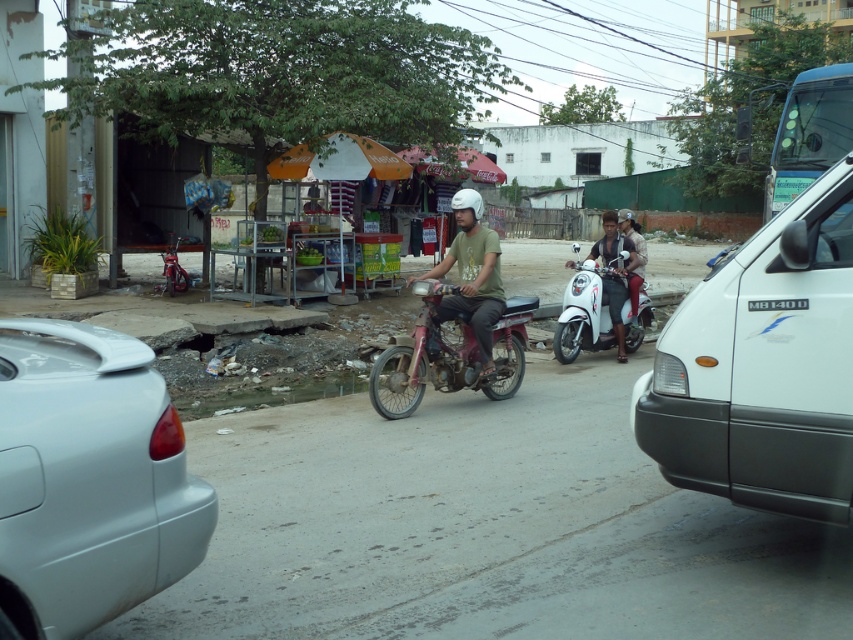
Which of these two, rusty metal motorcycle at center or matte green t-shirt at center, stands shorter?

rusty metal motorcycle at center

Does rusty metal motorcycle at center appear on the right side of matte green t-shirt at center?

In fact, rusty metal motorcycle at center is to the left of matte green t-shirt at center.

Who is more forward, (503, 369) or (473, 284)?

Point (473, 284) is more forward.

What are the coordinates of `rusty metal motorcycle at center` in the screenshot? It's located at (448, 355).

Does point (811, 490) come behind point (637, 259)?

No.

Can you confirm if white matte van at right is positioned to the right of white glossy scooter at center?

Incorrect, white matte van at right is not on the right side of white glossy scooter at center.

Between point (740, 308) and point (637, 264), which one is positioned in front?

Point (740, 308)

Locate an element on the screen. white matte van at right is located at coordinates (763, 365).

Does matte green t-shirt at center lie in front of matte black scooter at center?

Yes, it is in front of matte black scooter at center.

Does matte green t-shirt at center have a greater width compared to matte black scooter at center?

Yes, matte green t-shirt at center is wider than matte black scooter at center.

This screenshot has width=853, height=640. I want to click on matte green t-shirt at center, so click(473, 275).